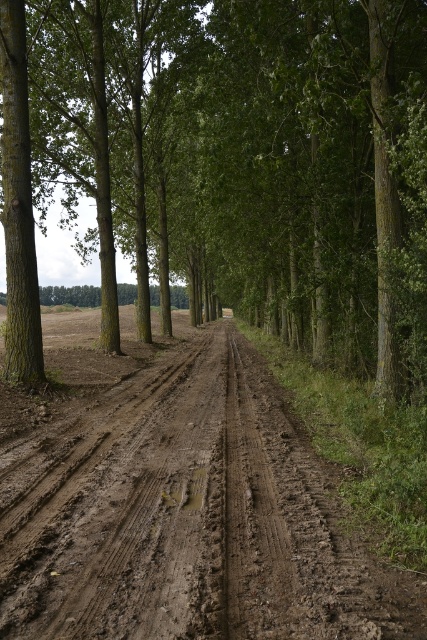
Is point (404, 81) farther from viewer compared to point (170, 556)?

Yes.

Is brown rough tree at center wider than brown muddy dirt track at center?

Indeed, brown rough tree at center has a greater width compared to brown muddy dirt track at center.

What do you see at coordinates (245, 160) in the screenshot?
I see `brown rough tree at center` at bounding box center [245, 160].

Identify the location of brown rough tree at center. (245, 160).